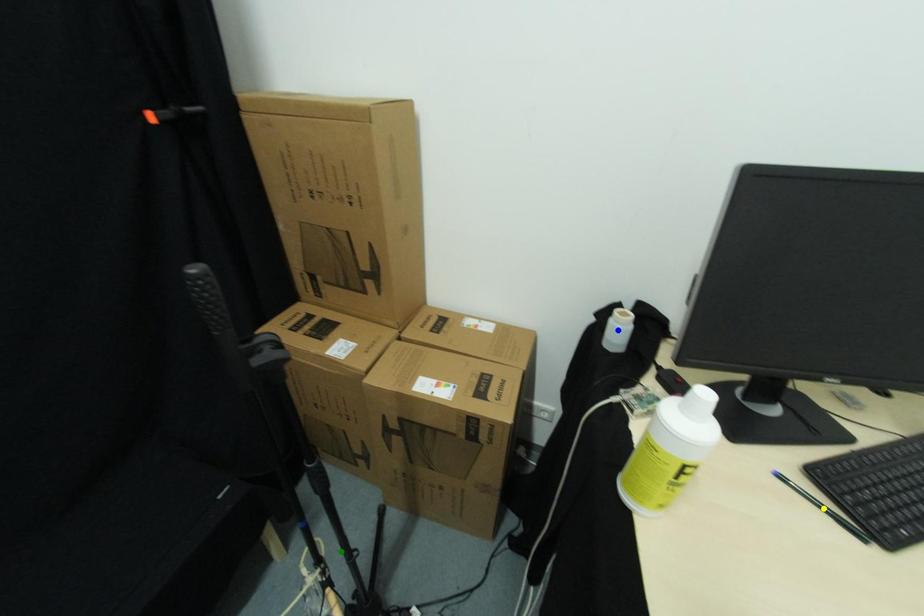
From the picture: Order these from nearest to farthest:
green point, yellow point, blue point

blue point, green point, yellow point